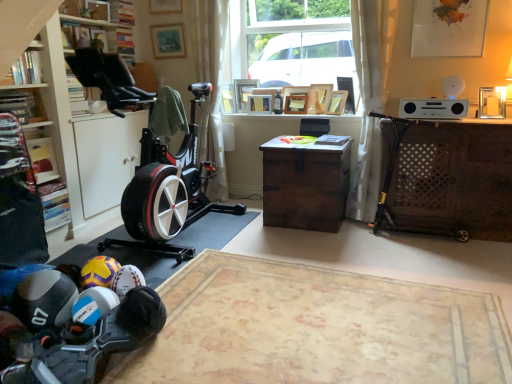
Identify the location of vacant space that is in between wooden desk at right, the second desk in the left-to-right sequence, and white matte baseball at lower left, the 2th toy when ordered from front to back. This screenshot has height=384, width=512. (335, 258).